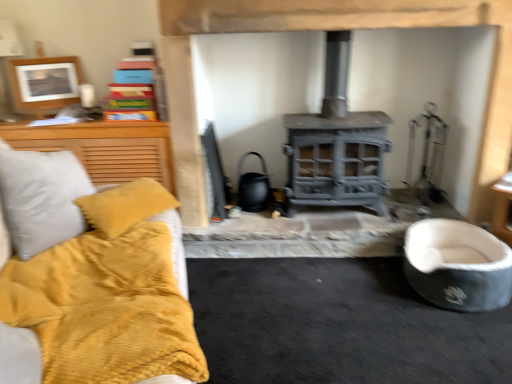
Question: Is soft gray fabric pet bed at lower right thinner than gray metallic fireplace at center?

Choices:
 (A) no
 (B) yes

Answer: (A)

Question: Is soft gray fabric pet bed at lower right wider than gray metallic fireplace at center?

Choices:
 (A) yes
 (B) no

Answer: (A)

Question: Is soft gray fabric pet bed at lower right further to camera compared to gray metallic fireplace at center?

Choices:
 (A) yes
 (B) no

Answer: (B)

Question: From a real-world perspective, is soft gray fabric pet bed at lower right located beneath gray metallic fireplace at center?

Choices:
 (A) no
 (B) yes

Answer: (B)

Question: Is gray metallic fireplace at center a part of soft gray fabric pet bed at lower right?

Choices:
 (A) yes
 (B) no

Answer: (B)

Question: Looking at the image, does soft gray fabric pet bed at lower right seem bigger or smaller compared to gray metallic fireplace at center?

Choices:
 (A) small
 (B) big

Answer: (A)

Question: From the image's perspective, is soft gray fabric pet bed at lower right located above or below gray metallic fireplace at center?

Choices:
 (A) below
 (B) above

Answer: (A)

Question: Relative to gray metallic fireplace at center, is soft gray fabric pet bed at lower right in front or behind?

Choices:
 (A) behind
 (B) front

Answer: (B)

Question: Is soft gray fabric pet bed at lower right taller or shorter than gray metallic fireplace at center?

Choices:
 (A) tall
 (B) short

Answer: (B)

Question: Considering their positions, is wooden picture frame at upper left located in front of or behind gray metallic fireplace at center?

Choices:
 (A) behind
 (B) front

Answer: (A)

Question: Is point (55, 87) closer or farther from the camera than point (287, 26)?

Choices:
 (A) closer
 (B) farther

Answer: (B)

Question: Is wooden picture frame at upper left to the left or to the right of gray metallic fireplace at center in the image?

Choices:
 (A) left
 (B) right

Answer: (A)

Question: From the image's perspective, is wooden picture frame at upper left located above or below gray metallic fireplace at center?

Choices:
 (A) above
 (B) below

Answer: (A)

Question: Is soft gray fabric pet bed at lower right wider or thinner than wooden picture frame at upper left?

Choices:
 (A) thin
 (B) wide

Answer: (B)

Question: From a real-world perspective, is soft gray fabric pet bed at lower right above or below wooden picture frame at upper left?

Choices:
 (A) below
 (B) above

Answer: (A)